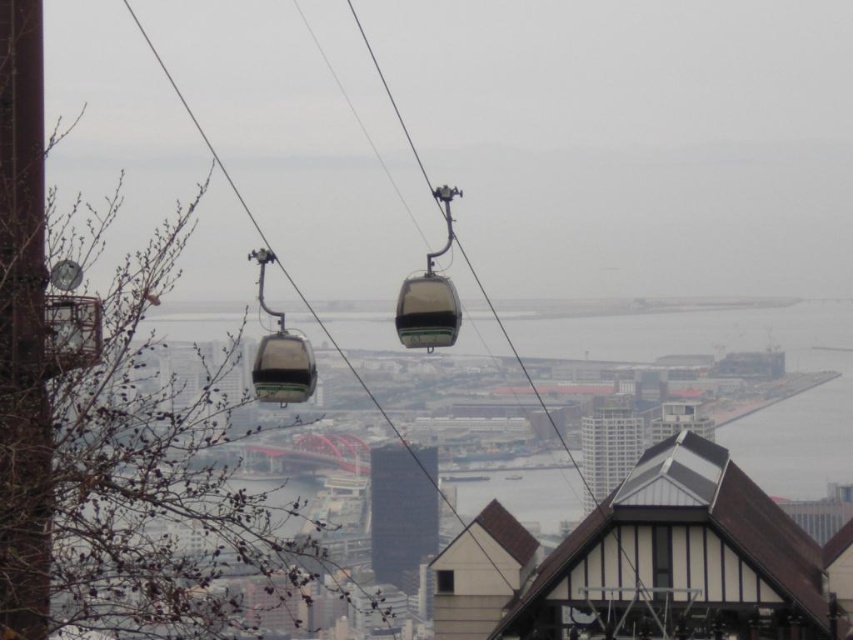
Looking at this image, you are a city planner reviewing a blueprint of the cable car system. The blueprint shows a point labeled as point (280, 353). What does this point represent?

The point (280, 353) indicates the location of the matte black cable car at center.

You are a city planner analyzing the cable car system. Given the coordinates of the matte black cable car at center, can you determine its position relative to the urban landscape?

The matte black cable car at center is positioned at coordinates point (x=280, y=353), placing it centrally within the frame and suspended above the urban landscape.

You are a tourist standing on the platform and want to take a photo of both the transparent glass cabin at center and the translucent plastic gondola at center. Which one will appear larger in the photo?

The translucent plastic gondola at center will appear larger in the photo because it is bigger than the transparent glass cabin at center.